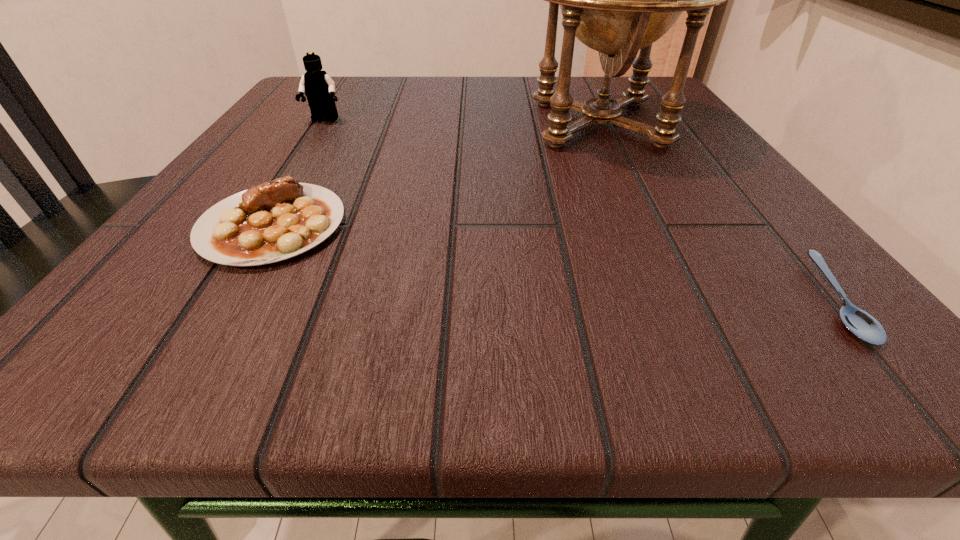
Locate an element on the screen. Image resolution: width=960 pixels, height=540 pixels. vacant region between the second tallest object and the steak is located at coordinates (299, 173).

Identify the location of blank region between the second tallest object and the shortest object. click(579, 210).

Identify the location of blank region between the steak and the shortest object. Image resolution: width=960 pixels, height=540 pixels. (553, 262).

Where is `free spot between the tallest object and the steak`? Image resolution: width=960 pixels, height=540 pixels. free spot between the tallest object and the steak is located at coordinates (436, 174).

This screenshot has height=540, width=960. I want to click on unoccupied position between the soupspoon and the second shortest object, so click(x=553, y=262).

This screenshot has height=540, width=960. I want to click on object that is the third nearest to the third shortest object, so click(863, 325).

Select which object appears as the third closest to the globe. Please provide its 2D coordinates. Your answer should be formatted as a tuple, i.e. [(x, y)], where the tuple contains the x and y coordinates of a point satisfying the conditions above.

[(319, 88)]

Image resolution: width=960 pixels, height=540 pixels. I want to click on free location that satisfies the following two spatial constraints: 1. on the front-facing side of the second tallest object; 2. on the right side of the steak, so click(256, 225).

You are a GUI agent. You are given a task and a screenshot of the screen. Output one action in this format:
    pyautogui.click(x=<x>, y=<y>)
    Task: Click on the vacant space that satisfies the following two spatial constraints: 1. on the front side of the second shortest object; 2. on the right side of the shortest object
    This screenshot has height=540, width=960.
    Given the screenshot: What is the action you would take?
    pyautogui.click(x=228, y=300)

Where is `free point that satisfies the following two spatial constraints: 1. on the front-facing side of the tallest object; 2. on the left side of the soupspoon`? This screenshot has height=540, width=960. free point that satisfies the following two spatial constraints: 1. on the front-facing side of the tallest object; 2. on the left side of the soupspoon is located at coordinates (685, 300).